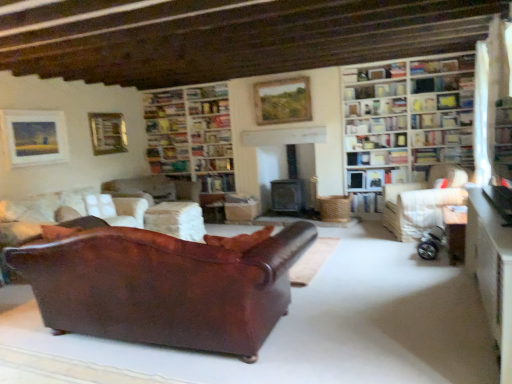
Locate an element on the screen. The image size is (512, 384). spots to the right of leather couch at center, marked as the second studio couch in a right-to-left arrangement is located at coordinates (370, 308).